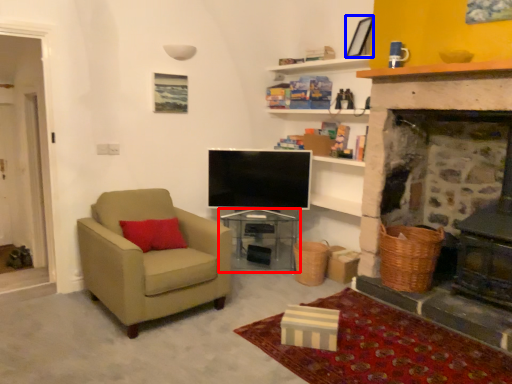
Question: Among these objects, which one is nearest to the camera, table (highlighted by a red box) or picture frame (highlighted by a blue box)?

Choices:
 (A) table
 (B) picture frame

Answer: (B)